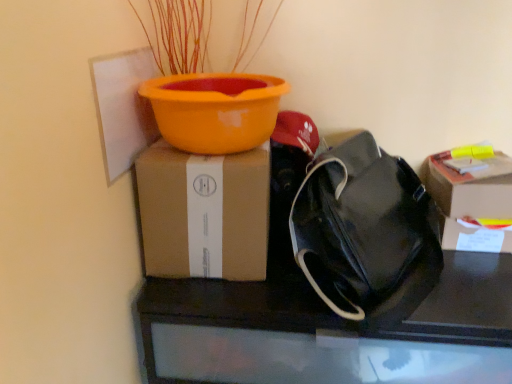
Identify the location of vacant space in front of cardboard box at right, arranged as the second box when viewed from the left. The width and height of the screenshot is (512, 384). (482, 284).